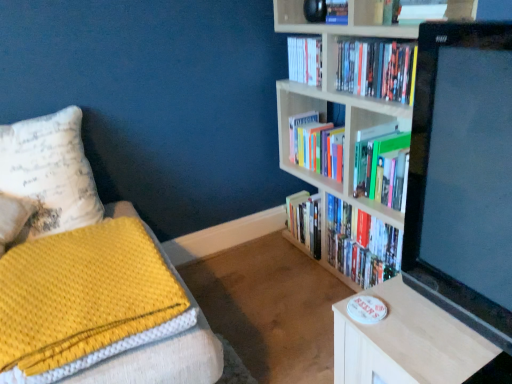
Question: Can you confirm if yellow textured blanket at lower left is thinner than white paper at upper center, the 1th book in the front-to-back sequence?

Choices:
 (A) no
 (B) yes

Answer: (A)

Question: Is yellow textured blanket at lower left located outside white paper at upper center, which appears as the 4th book when viewed from the back?

Choices:
 (A) no
 (B) yes

Answer: (B)

Question: From a real-world perspective, is yellow textured blanket at lower left over white paper at upper center, which appears as the 4th book when viewed from the back?

Choices:
 (A) no
 (B) yes

Answer: (A)

Question: Is yellow textured blanket at lower left further to camera compared to white paper at upper center, the 1th book in the front-to-back sequence?

Choices:
 (A) no
 (B) yes

Answer: (A)

Question: Is yellow textured blanket at lower left facing towards white paper at upper center, the 1th book in the front-to-back sequence?

Choices:
 (A) yes
 (B) no

Answer: (B)

Question: Is there a large distance between yellow textured blanket at lower left and white paper at upper center, the 1th book in the front-to-back sequence?

Choices:
 (A) no
 (B) yes

Answer: (B)

Question: Is hardcover books at center, which ranks as the fourth book in front-to-back order, inside black glossy monitor at upper right?

Choices:
 (A) no
 (B) yes

Answer: (A)

Question: Considering the relative sizes of black glossy monitor at upper right and hardcover books at center, which ranks as the fourth book in front-to-back order, in the image provided, is black glossy monitor at upper right taller than hardcover books at center, which ranks as the fourth book in front-to-back order,?

Choices:
 (A) no
 (B) yes

Answer: (B)

Question: Considering the relative positions of black glossy monitor at upper right and hardcover books at center, which ranks as the fourth book in front-to-back order, in the image provided, is black glossy monitor at upper right to the left of hardcover books at center, which ranks as the fourth book in front-to-back order, from the viewer's perspective?

Choices:
 (A) yes
 (B) no

Answer: (B)

Question: From a real-world perspective, is black glossy monitor at upper right physically below hardcover books at center, which ranks as the fourth book in front-to-back order?

Choices:
 (A) no
 (B) yes

Answer: (A)

Question: Considering the relative sizes of black glossy monitor at upper right and hardcover books at center, the first book in the back-to-front sequence, in the image provided, is black glossy monitor at upper right thinner than hardcover books at center, the first book in the back-to-front sequence,?

Choices:
 (A) no
 (B) yes

Answer: (A)

Question: Is black glossy monitor at upper right at the right side of hardcover books at center, the first book in the back-to-front sequence?

Choices:
 (A) no
 (B) yes

Answer: (B)

Question: Can we say white paperback book at upper center, the 3th book from the front, lies outside white matte bookcase at upper right?

Choices:
 (A) yes
 (B) no

Answer: (B)